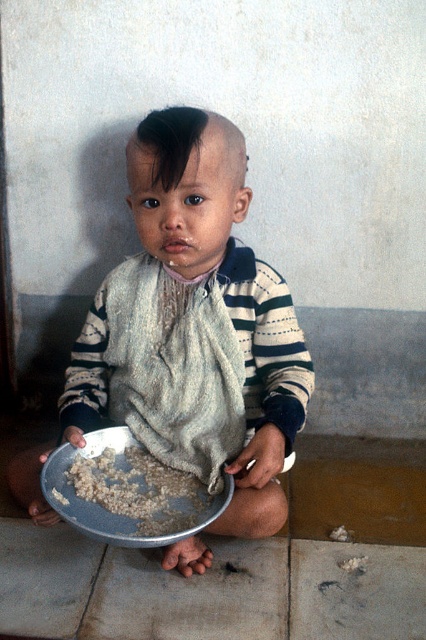
Question: Does striped cotton shirt at center have a greater width compared to brown rice at lower center?

Choices:
 (A) no
 (B) yes

Answer: (B)

Question: Can you confirm if striped cotton shirt at center is positioned to the left of brown rice at lower center?

Choices:
 (A) yes
 (B) no

Answer: (B)

Question: Among these objects, which one is nearest to the camera?

Choices:
 (A) striped cotton shirt at center
 (B) brown rice at lower center

Answer: (B)

Question: Can you confirm if striped cotton shirt at center is positioned to the left of brown rice at lower center?

Choices:
 (A) no
 (B) yes

Answer: (A)

Question: Which of the following is the closest to the observer?

Choices:
 (A) (155, 200)
 (B) (164, 525)

Answer: (B)